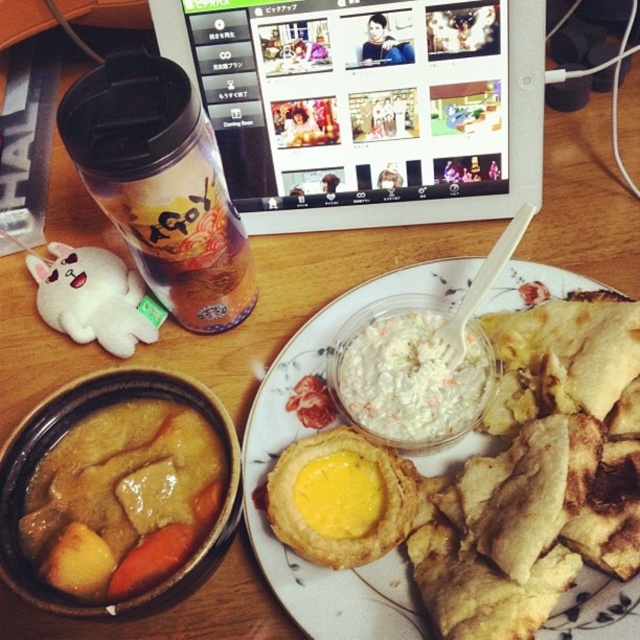
Does white plastic tablet at upper center have a greater width compared to brown matte cup at left?

Yes.

The width and height of the screenshot is (640, 640). What do you see at coordinates (368, 106) in the screenshot?
I see `white plastic tablet at upper center` at bounding box center [368, 106].

Which is behind, point (332, 45) or point (163, 109)?

The point (332, 45) is behind.

Image resolution: width=640 pixels, height=640 pixels. I want to click on white plastic tablet at upper center, so click(x=368, y=106).

Which of these two, white plastic tablet at upper center or golden brown curry at plate center, stands taller?

Standing taller between the two is white plastic tablet at upper center.

Which is below, white plastic tablet at upper center or golden brown curry at plate center?

A: golden brown curry at plate center is lower down.

What do you see at coordinates (368, 106) in the screenshot? I see `white plastic tablet at upper center` at bounding box center [368, 106].

This screenshot has height=640, width=640. In order to click on white plastic tablet at upper center in this screenshot , I will do `click(368, 106)`.

How much distance is there between white matte plate at center and brown matte cup at left?

white matte plate at center and brown matte cup at left are 7.31 inches apart.

This screenshot has height=640, width=640. Find the location of `white matte plate at center`. white matte plate at center is located at coordinates (312, 433).

The width and height of the screenshot is (640, 640). I want to click on white matte plate at center, so click(312, 433).